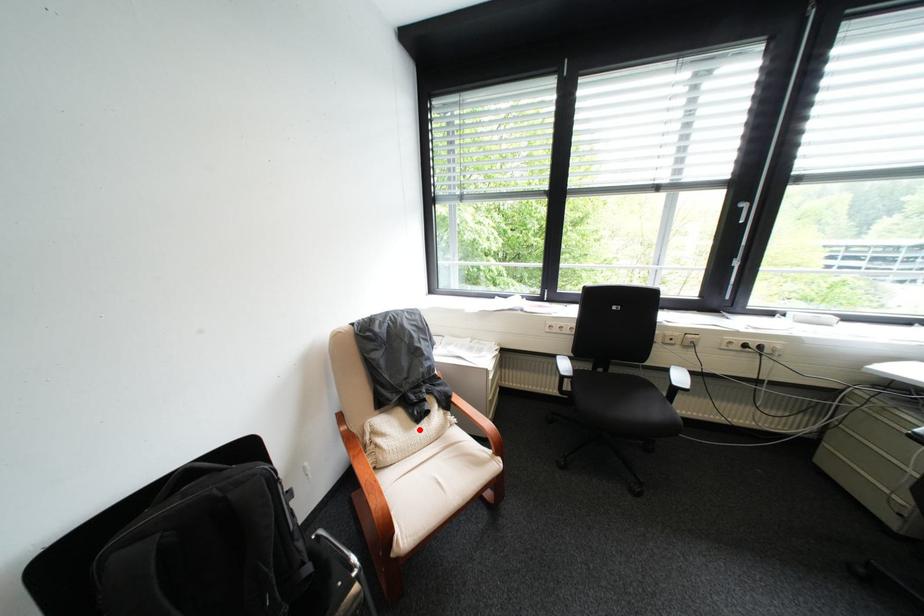
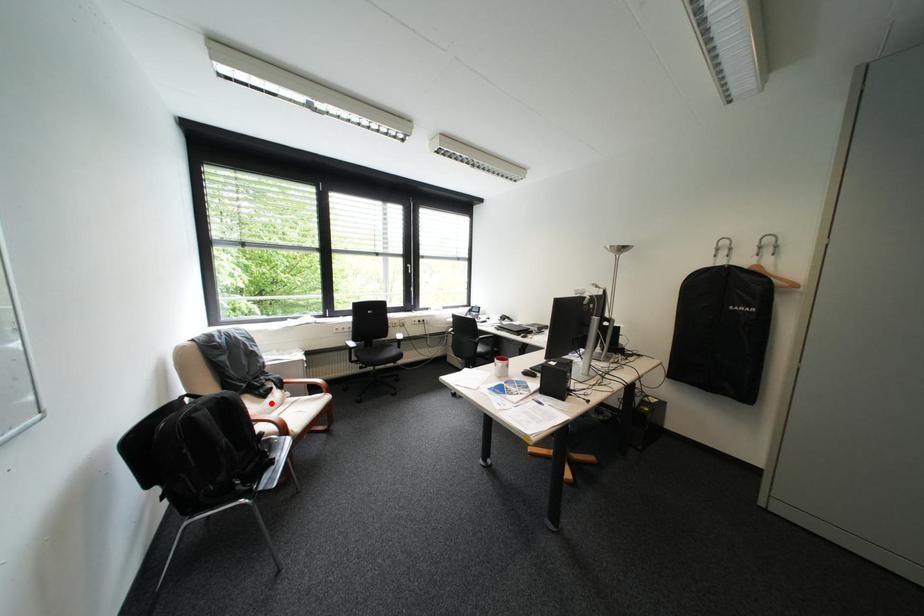
I am providing you with two images of the same scene from different viewpoints. A red point is marked on the first image and another point is marked on the second image. Is the marked point in image1 the same physical position as the marked point in image2?

Yes